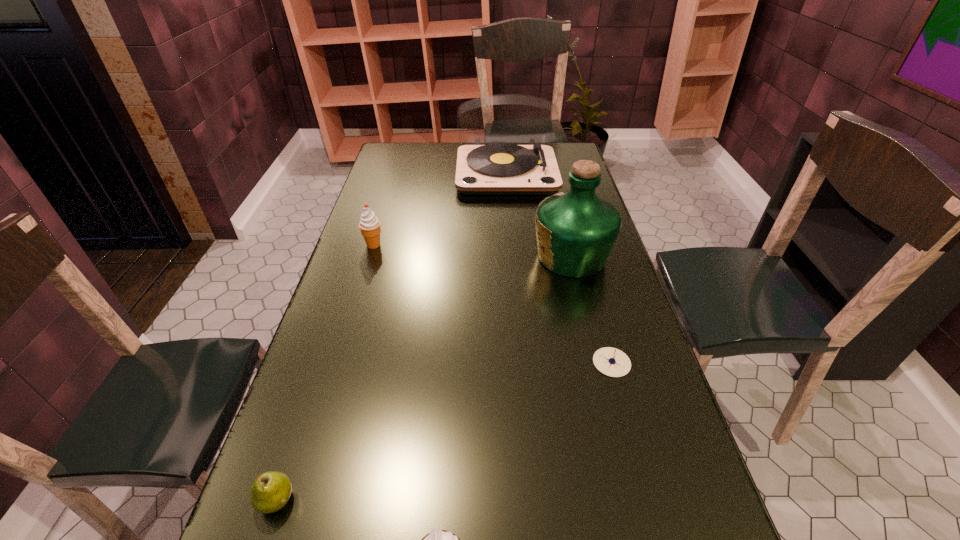
I want to click on the closest object relative to the second shortest object, so click(x=437, y=539).

Image resolution: width=960 pixels, height=540 pixels. Find the location of `the fourth closest object to the farthest object`. the fourth closest object to the farthest object is located at coordinates (270, 491).